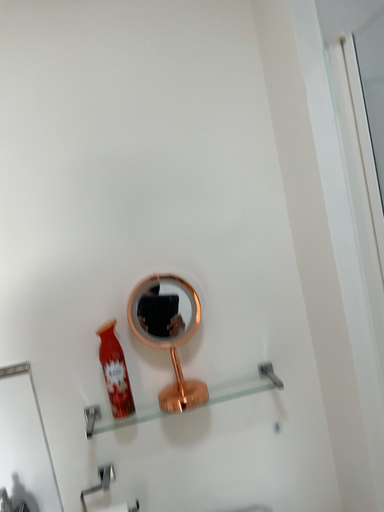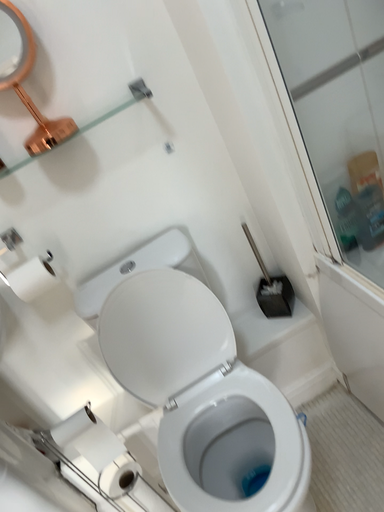
Question: Which way did the camera rotate in the video?

Choices:
 (A) rotated right
 (B) rotated left

Answer: (A)